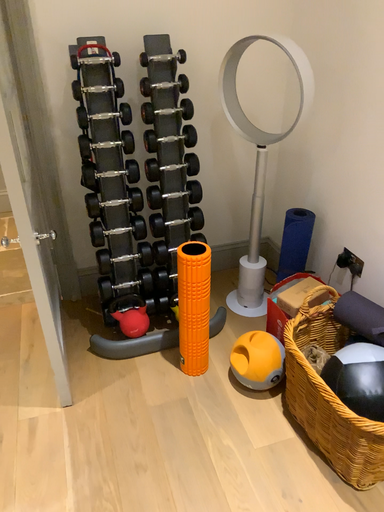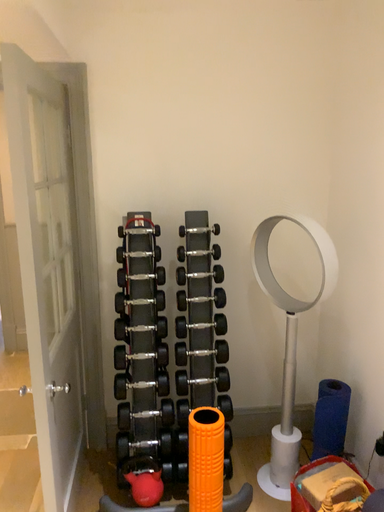
Question: Which way did the camera rotate in the video?

Choices:
 (A) rotated upward
 (B) rotated downward

Answer: (A)